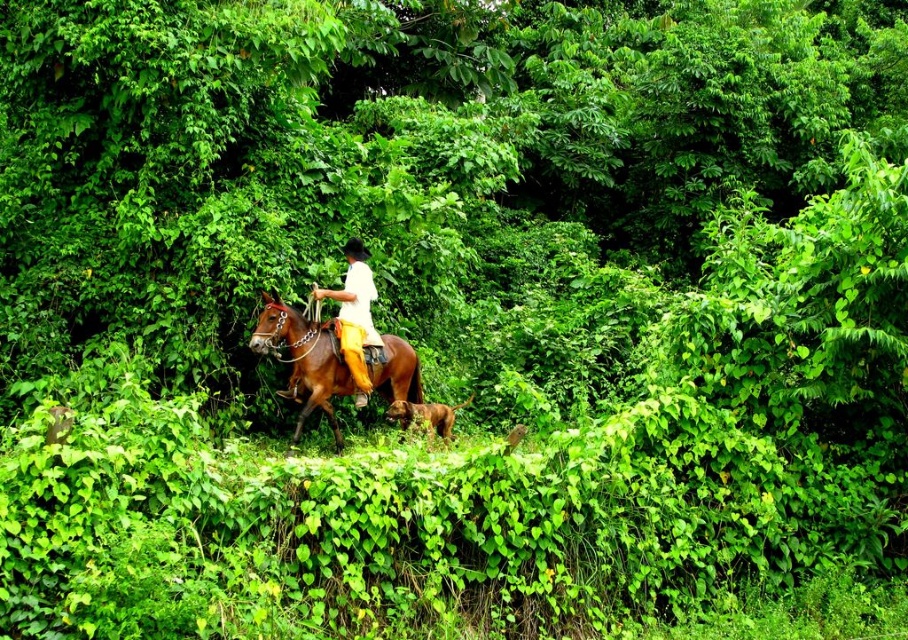
You are a hiker trying to locate your friend who is riding a horse in the forest. You see the brown glossy horse at center and the yellow fabric pants at center. Which object is positioned lower in the image?

The brown glossy horse at center is positioned lower than the yellow fabric pants at center in the image.

In the scene shown: You are a hiker who wants to take a photo of the brown glossy horse at center and the yellow fabric pants at center. Which object should you focus on first if you want to capture both in a single frame without moving the camera?

The brown glossy horse at center has a larger size compared to the yellow fabric pants at center, so you should focus on the brown glossy horse at center first to ensure it is in sharp focus before adjusting for the smaller object.

You are a hiker navigating through the forest and need to determine the shortest path between the two points marked in the image. Which point is closer to you, point (301, 390) or point (364, 378)?

Point (301, 390) is closer to the viewer than point (364, 378), so the shortest path would start from point (301, 390).